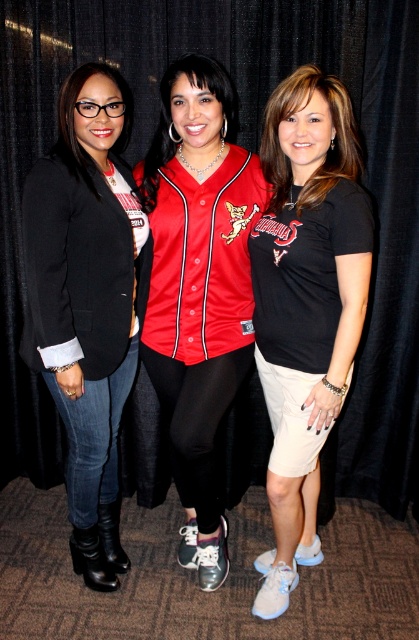
Is black matte t-shirt at center taller than red matte baseball jersey at center?

No, black matte t-shirt at center is not taller than red matte baseball jersey at center.

Between black matte t-shirt at center and red matte baseball jersey at center, which one has more height?

red matte baseball jersey at center is taller.

Find the location of a particular element. black matte t-shirt at center is located at coordinates (305, 304).

Which is more to the left, matte black blazer at left or red matte baseball jersey at center?

Positioned to the left is matte black blazer at left.

Which of these two, matte black blazer at left or red matte baseball jersey at center, stands shorter?

matte black blazer at left is shorter.

Who is more distant from viewer, (145,253) or (216,92)?

The point (145,253) is behind.

You are a GUI agent. You are given a task and a screenshot of the screen. Output one action in this format:
    pyautogui.click(x=<x>, y=<y>)
    Task: Click on the matte black blazer at left
    
    Given the screenshot: What is the action you would take?
    pyautogui.click(x=87, y=300)

Is point (300, 192) more distant than point (137, 300)?

No, it is in front of (137, 300).

Which is more to the right, black matte t-shirt at center or matte black blazer at left?

black matte t-shirt at center is more to the right.

Is point (264, 337) closer to camera compared to point (74, 369)?

No, (264, 337) is behind (74, 369).

At what (x,y) coordinates should I click in order to perform the action: click on black matte t-shirt at center. Please return your answer as a coordinate pair (x, y). This screenshot has height=640, width=419. Looking at the image, I should click on (x=305, y=304).